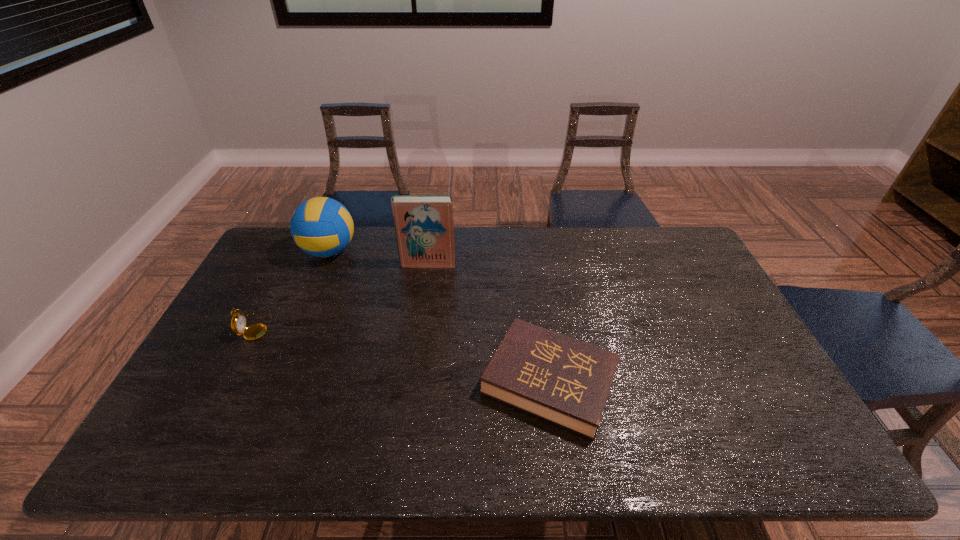
At what (x,y) coordinates should I click in order to perform the action: click on free space that is in between the third object from left to right and the nearer hardback book. Please return your answer as a coordinate pair (x, y). The image size is (960, 540). Looking at the image, I should click on (489, 323).

Find the location of a particular element. vacant space that's between the pocket watch and the volleyball is located at coordinates (x=292, y=289).

This screenshot has width=960, height=540. I want to click on vacant space in between the shorter hardback book and the pocket watch, so click(x=402, y=354).

Image resolution: width=960 pixels, height=540 pixels. Identify the location of free space between the volleyball and the pocket watch. (292, 289).

I want to click on free point between the left hardback book and the pocket watch, so click(342, 295).

Where is `free space between the volleyball and the pocket watch`? free space between the volleyball and the pocket watch is located at coordinates (292, 289).

Find the location of a particular element. This screenshot has width=960, height=540. free space between the taller hardback book and the volleyball is located at coordinates (378, 258).

Locate an element on the screen. vacant space in between the tallest object and the nearer hardback book is located at coordinates (489, 323).

You are a GUI agent. You are given a task and a screenshot of the screen. Output one action in this format:
    pyautogui.click(x=<x>, y=<y>)
    Task: Click on the free spot between the volleyball and the nearer hardback book
    The height and width of the screenshot is (540, 960).
    Given the screenshot: What is the action you would take?
    pyautogui.click(x=440, y=316)

In order to click on free space between the shortest object and the third shortest object in this screenshot , I will do `click(440, 316)`.